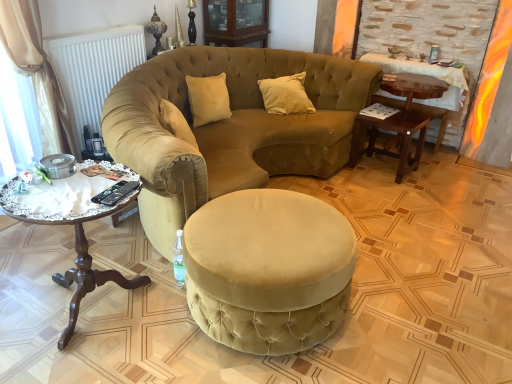
Question: From the image's perspective, is matte wood cabinet at upper center under woodenwoodencoffee table at left?

Choices:
 (A) no
 (B) yes

Answer: (A)

Question: Can you confirm if matte wood cabinet at upper center is wider than woodenwoodencoffee table at left?

Choices:
 (A) yes
 (B) no

Answer: (B)

Question: Is matte wood cabinet at upper center positioned with its back to woodenwoodencoffee table at left?

Choices:
 (A) yes
 (B) no

Answer: (B)

Question: Could you tell me if matte wood cabinet at upper center is facing woodenwoodencoffee table at left?

Choices:
 (A) no
 (B) yes

Answer: (A)

Question: Is matte wood cabinet at upper center positioned beyond the bounds of woodenwoodencoffee table at left?

Choices:
 (A) no
 (B) yes

Answer: (B)

Question: From a real-world perspective, is matte wood cabinet at upper center above or below wooden table at right?

Choices:
 (A) above
 (B) below

Answer: (A)

Question: Considering the positions of matte wood cabinet at upper center and wooden table at right in the image, is matte wood cabinet at upper center bigger or smaller than wooden table at right?

Choices:
 (A) big
 (B) small

Answer: (B)

Question: Is matte wood cabinet at upper center spatially inside wooden table at right, or outside of it?

Choices:
 (A) outside
 (B) inside

Answer: (A)

Question: In terms of width, does matte wood cabinet at upper center look wider or thinner when compared to wooden table at right?

Choices:
 (A) thin
 (B) wide

Answer: (B)

Question: From a real-world perspective, is velvet beige sofa at center physically located above or below white matte radiator at upper left?

Choices:
 (A) above
 (B) below

Answer: (B)

Question: Is velvet beige sofa at center to the left or to the right of white matte radiator at upper left in the image?

Choices:
 (A) right
 (B) left

Answer: (A)

Question: Considering the positions of velvet beige sofa at center and white matte radiator at upper left in the image, is velvet beige sofa at center wider or thinner than white matte radiator at upper left?

Choices:
 (A) wide
 (B) thin

Answer: (A)

Question: From the image's perspective, is velvet beige sofa at center positioned above or below white matte radiator at upper left?

Choices:
 (A) above
 (B) below

Answer: (B)

Question: Choose the correct answer: Is black plastic remote control at lower left inside velvet ottoman at center or outside it?

Choices:
 (A) inside
 (B) outside

Answer: (B)

Question: In terms of size, does black plastic remote control at lower left appear bigger or smaller than velvet ottoman at center?

Choices:
 (A) small
 (B) big

Answer: (A)